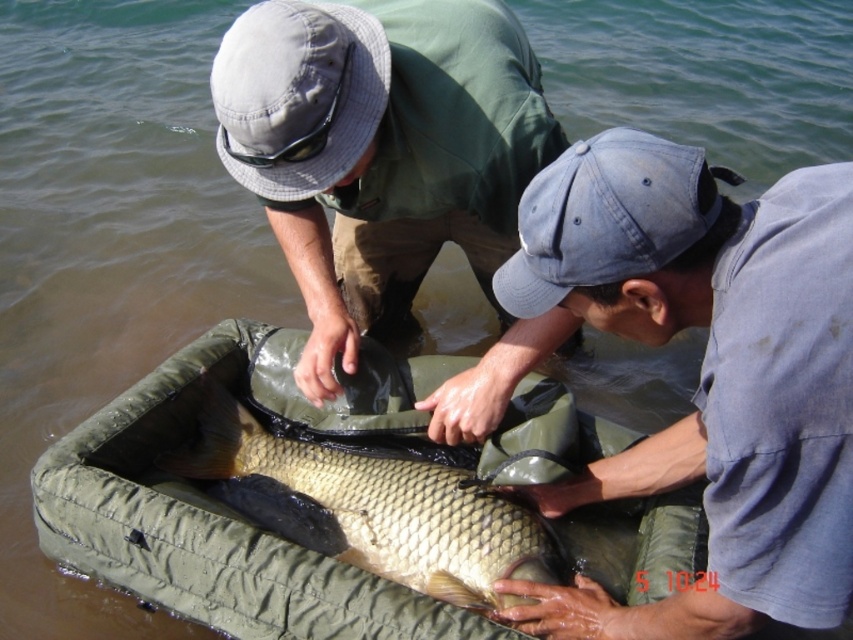
Looking at this image, is shiny gold fish at center to the right of denim baseball cap at lower right from the viewer's perspective?

No, shiny gold fish at center is not to the right of denim baseball cap at lower right.

Can you confirm if shiny gold fish at center is wider than denim baseball cap at lower right?

Yes.

Is point (202, 464) closer to camera compared to point (585, 268)?

That is False.

Where is `shiny gold fish at center`? shiny gold fish at center is located at coordinates (372, 509).

Does green fabric bag at center appear on the left side of denim baseball cap at lower right?

Yes, green fabric bag at center is to the left of denim baseball cap at lower right.

How much distance is there between green fabric bag at center and denim baseball cap at lower right?

green fabric bag at center is 21.97 inches from denim baseball cap at lower right.

Find the location of a particular element. The height and width of the screenshot is (640, 853). green fabric bag at center is located at coordinates (379, 148).

Where is `green fabric bag at center`? green fabric bag at center is located at coordinates (379, 148).

Is point (334, 61) more distant than point (520, 596)?

No.

Between green fabric bag at center and shiny gold fish at center, which one appears on the left side from the viewer's perspective?

From the viewer's perspective, shiny gold fish at center appears more on the left side.

Locate an element on the screen. This screenshot has width=853, height=640. green fabric bag at center is located at coordinates (379, 148).